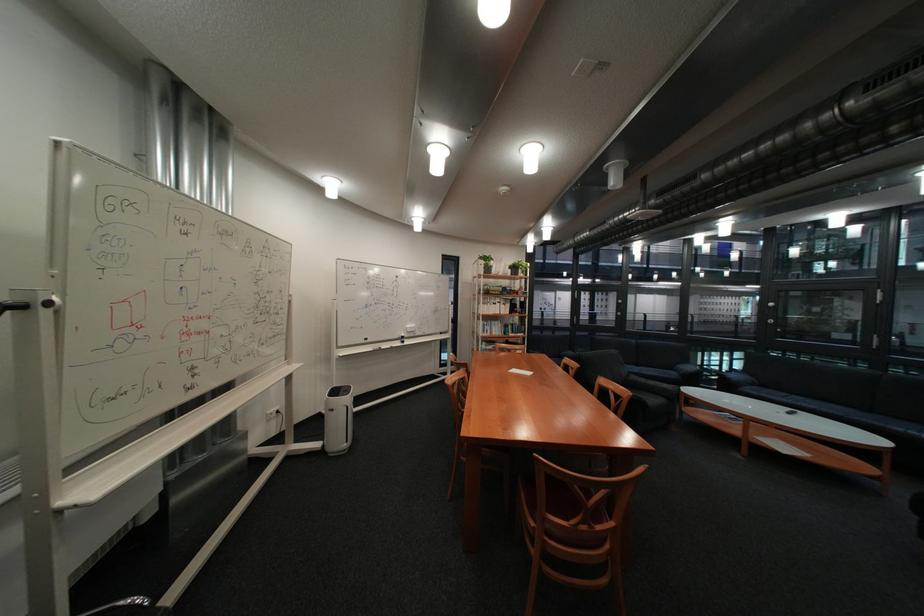
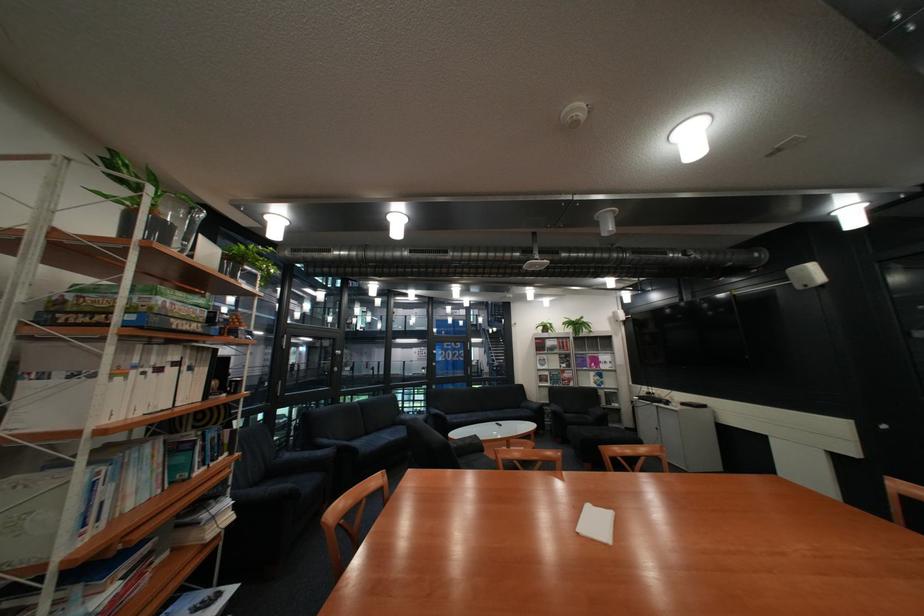
Locate, in the second image, the point that corresponds to point (812, 321) in the first image.

(344, 365)